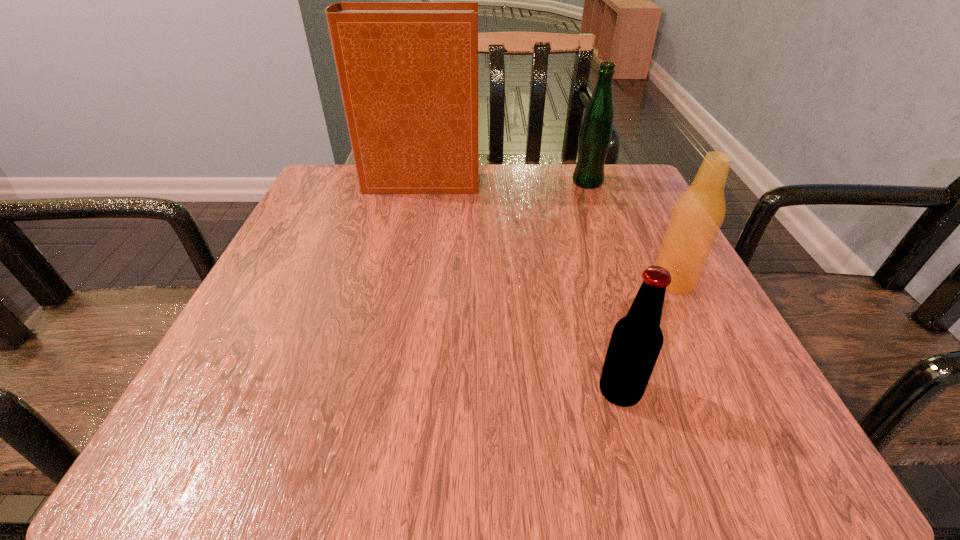
Locate an element on the screen. free region at the right edge of the desktop is located at coordinates (651, 225).

Identify the location of vacant space at the far left corner of the desktop. The image size is (960, 540). (339, 194).

Locate an element on the screen. free space at the far right corner of the desktop is located at coordinates (643, 217).

The image size is (960, 540). In order to click on empty space between the second nearest object and the hardback book in this screenshot , I will do click(x=546, y=232).

Where is `free space that is in between the tallest object and the farthest beer bottle`? This screenshot has width=960, height=540. free space that is in between the tallest object and the farthest beer bottle is located at coordinates (503, 183).

Identify the location of free space that is in between the tallest object and the farthest beer bottle. The width and height of the screenshot is (960, 540). (503, 183).

Locate an element on the screen. empty location between the tallest object and the nearest object is located at coordinates (519, 287).

Locate an element on the screen. This screenshot has height=540, width=960. free area in between the rightmost object and the hardback book is located at coordinates (546, 232).

This screenshot has width=960, height=540. In order to click on free space between the nearest beer bottle and the farthest beer bottle in this screenshot , I will do `click(603, 287)`.

Where is `blank region between the tallest object and the rightmost beer bottle`? blank region between the tallest object and the rightmost beer bottle is located at coordinates (546, 232).